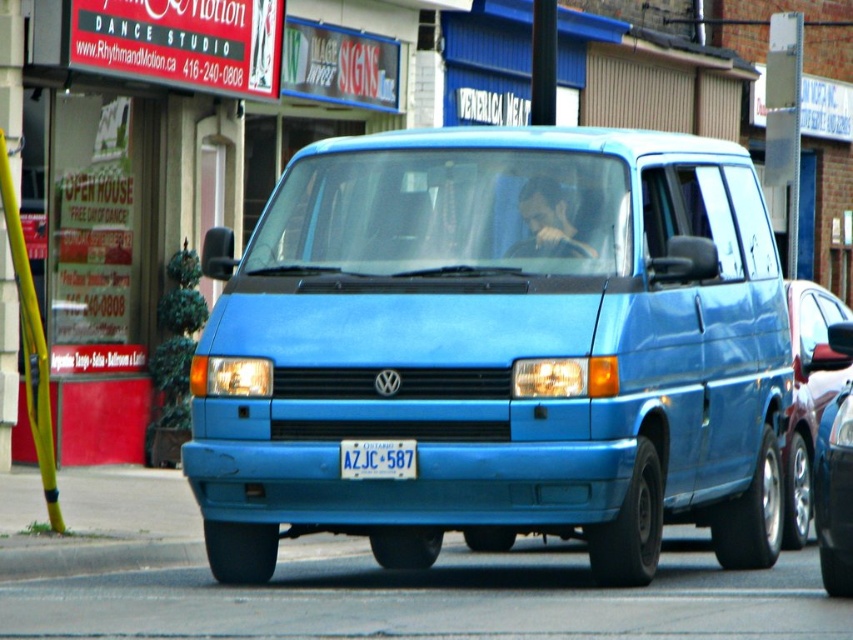
You are a city planner analyzing traffic patterns. You need to determine the exact location of the matte blue van at center in the image. What are its coordinates?

The matte blue van at center is located at coordinates point (x=497, y=348).

You are standing on the sidewalk and see the blue matte van at center approaching you. If the van is moving at 10 km per hour, how many seconds will it take for the van to reach you?

The blue matte van at center is 14.10 meters away from you. At a speed of 10 km per hour, it will take approximately 5 seconds to reach you.